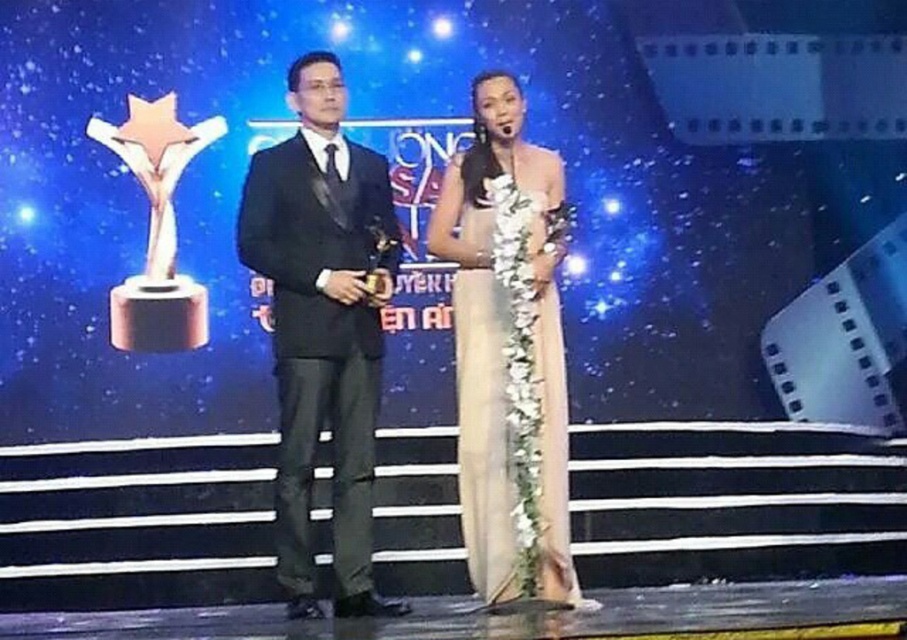
Measure the distance from black satin suit at center to satin beige dress at center.

black satin suit at center and satin beige dress at center are 84.75 centimeters apart from each other.

Is point (356, 531) positioned after point (481, 394)?

No, it is not.

Identify the location of black satin suit at center. The width and height of the screenshot is (907, 640). (323, 326).